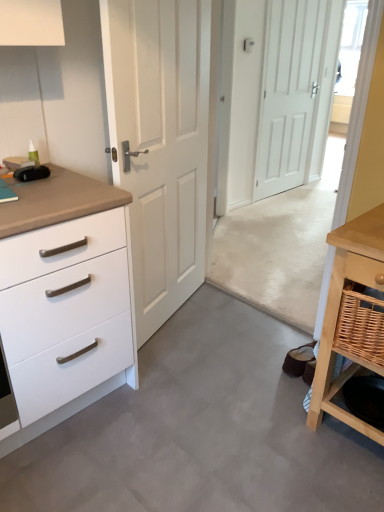
At what (x,y) coordinates should I click in order to perform the action: click on vacant space to the right of white matte chest of drawers at left. Please return your answer as a coordinate pair (x, y). The width and height of the screenshot is (384, 512). Looking at the image, I should click on (185, 401).